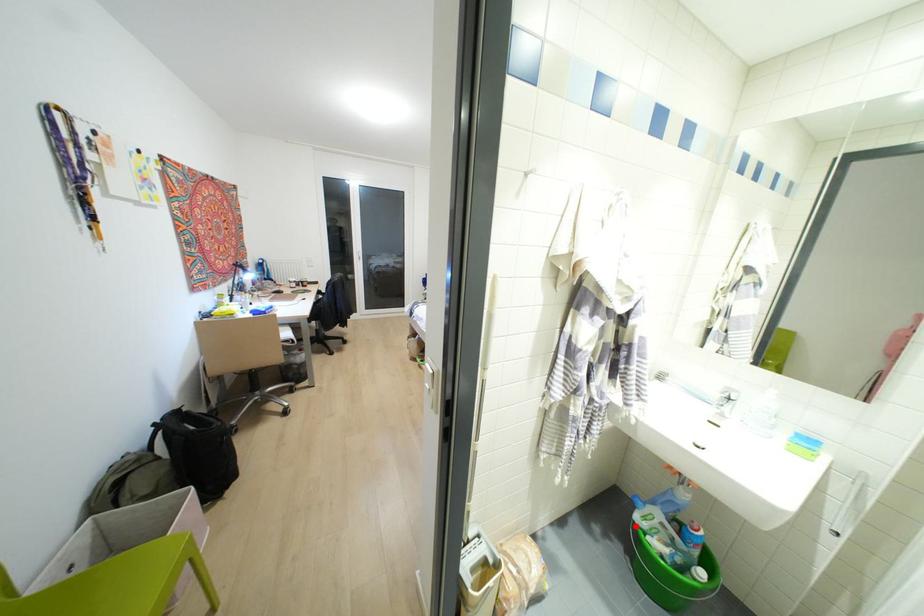
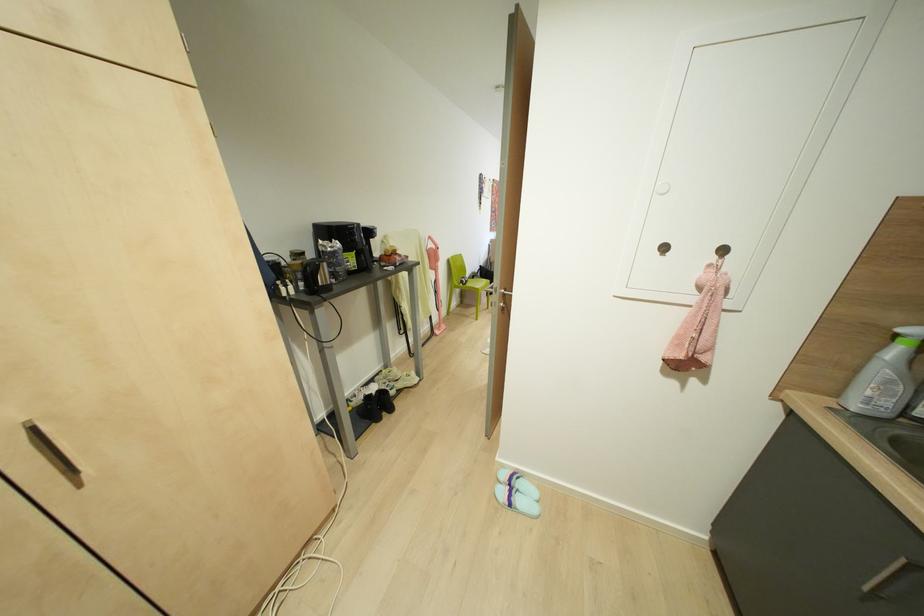
Question: I am providing you with two images of the same scene from different viewpoints. A red point is marked on the first image. Can you still see the location of the red point in image 2?

Choices:
 (A) Yes
 (B) No

Answer: (B)